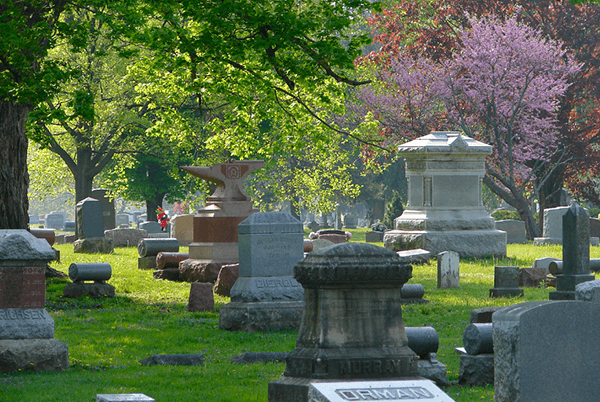
Find the location of a particular element. The width and height of the screenshot is (600, 402). shade is located at coordinates (146, 326), (503, 262).